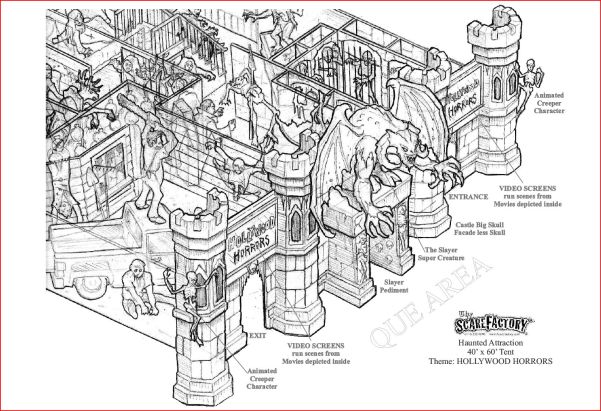
This screenshot has width=601, height=411. In order to click on entrance in this screenshot , I will do `click(456, 151)`.